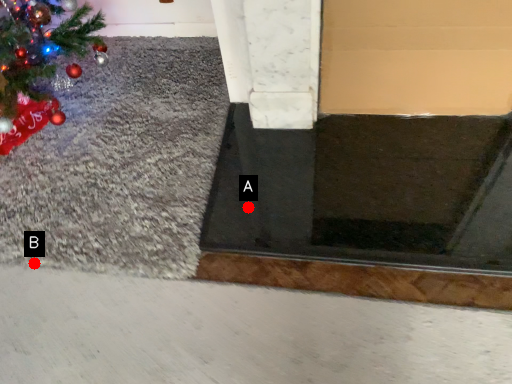
Question: Two points are circled on the image, labeled by A and B beside each circle. Which point is further to the camera?

Choices:
 (A) A is further
 (B) B is further

Answer: (A)